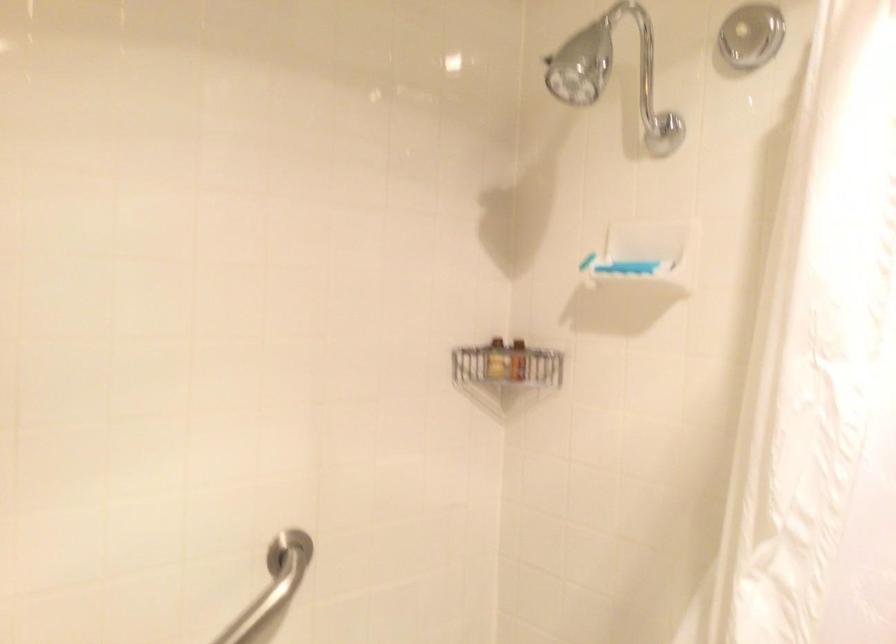
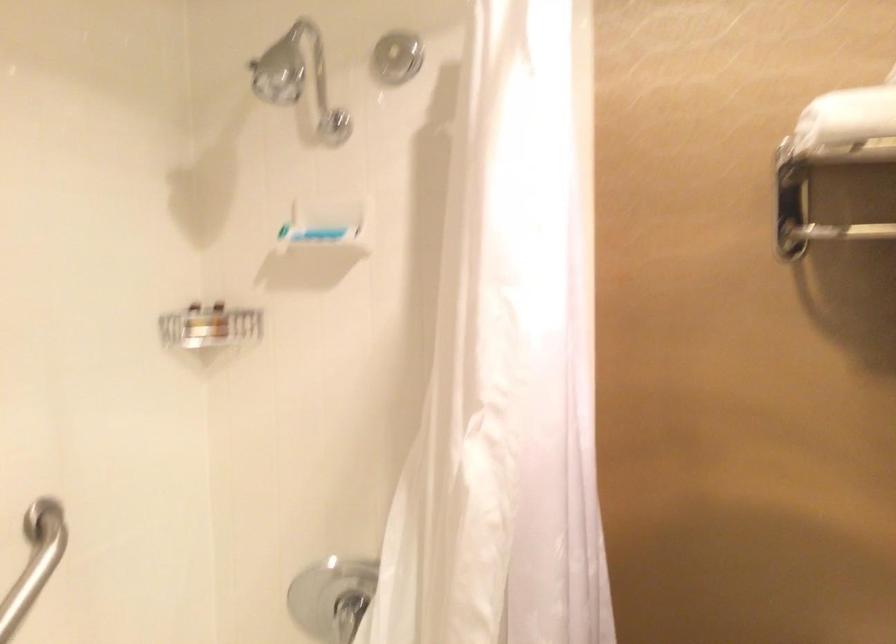
Where in the second image is the point corresponding to point 513,360 from the first image?

(218, 321)